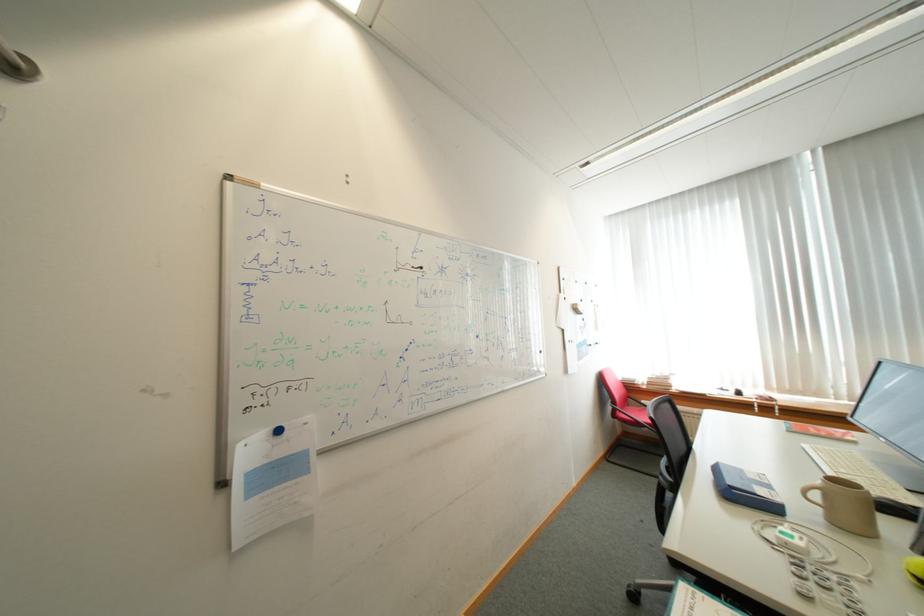
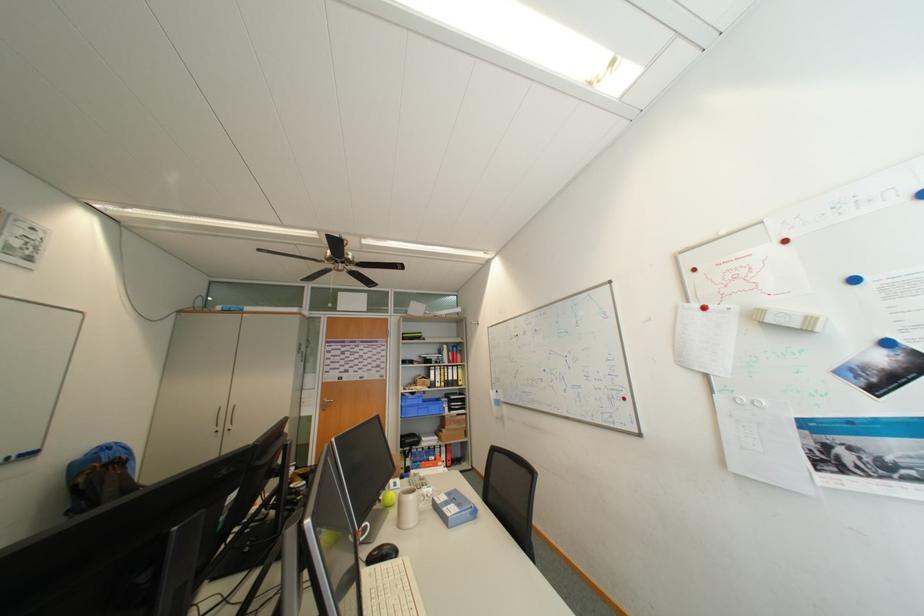
The point at (590, 310) is marked in the first image. Where is the corresponding point in the second image?

(777, 322)